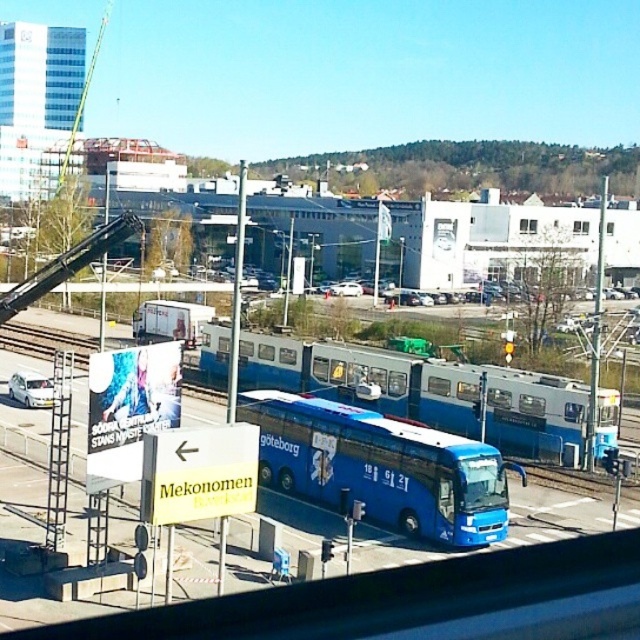
Question: Does blue matte bus at center come behind blue metallic bus at center?

Choices:
 (A) no
 (B) yes

Answer: (A)

Question: Does blue matte bus at center have a greater width compared to blue metallic bus at center?

Choices:
 (A) yes
 (B) no

Answer: (B)

Question: Which object appears farthest from the camera in this image?

Choices:
 (A) blue metallic bus at center
 (B) blue matte bus at center

Answer: (A)

Question: Which of the following is the closest to the observer?

Choices:
 (A) blue metallic bus at center
 (B) blue matte bus at center

Answer: (B)

Question: Does blue matte bus at center appear on the left side of blue metallic bus at center?

Choices:
 (A) no
 (B) yes

Answer: (B)